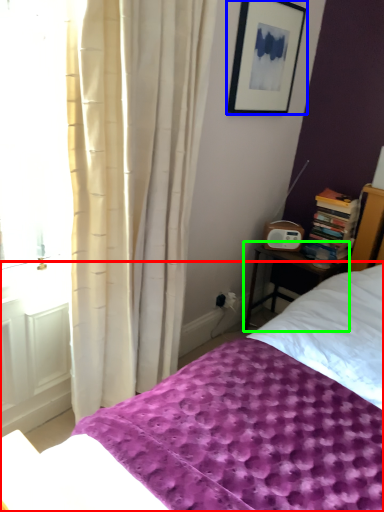
Question: Considering the real-world distances, which object is farthest from bed (highlighted by a red box)? picture frame (highlighted by a blue box) or nightstand (highlighted by a green box)?

Choices:
 (A) picture frame
 (B) nightstand

Answer: (A)